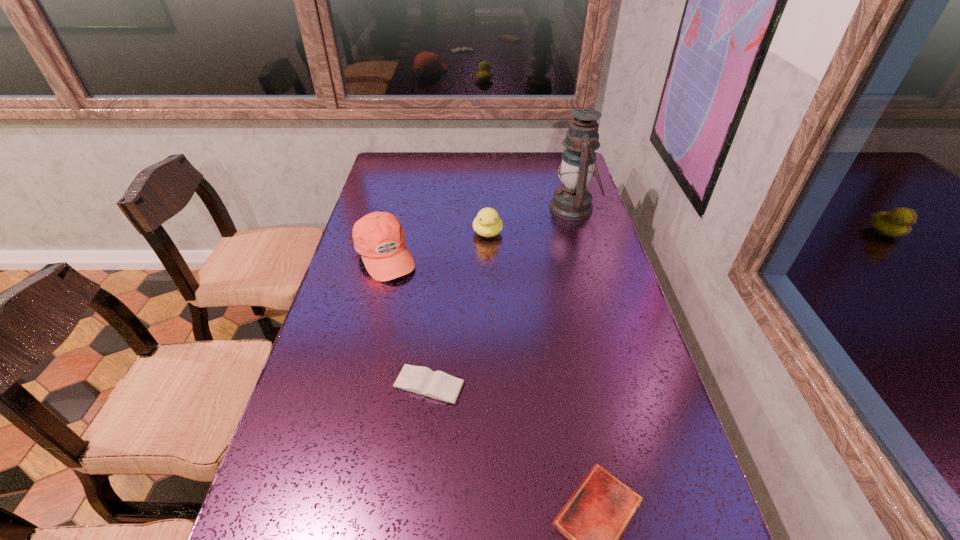
The width and height of the screenshot is (960, 540). Find the location of `the tallest object`. the tallest object is located at coordinates (572, 201).

The width and height of the screenshot is (960, 540). In order to click on the second tallest object in this screenshot , I will do `click(379, 238)`.

Locate an element on the screen. The height and width of the screenshot is (540, 960). the third tallest object is located at coordinates (487, 223).

Identify the location of duckling. (487, 223).

Locate an element on the screen. The height and width of the screenshot is (540, 960). the left diary is located at coordinates (438, 385).

Locate an element on the screen. Image resolution: width=960 pixels, height=540 pixels. the farther diary is located at coordinates (438, 385).

This screenshot has width=960, height=540. Identify the location of free space located 0.210m on the back of the oil lamp. (562, 165).

Where is `vacant area located on the back of the second tallest object`? Image resolution: width=960 pixels, height=540 pixels. vacant area located on the back of the second tallest object is located at coordinates (395, 212).

Identify the location of vacant space located 0.220m at the beak of the third tallest object. This screenshot has height=540, width=960. (489, 289).

Identify the location of vacant space situated 0.210m on the back of the left diary. This screenshot has width=960, height=540. (437, 304).